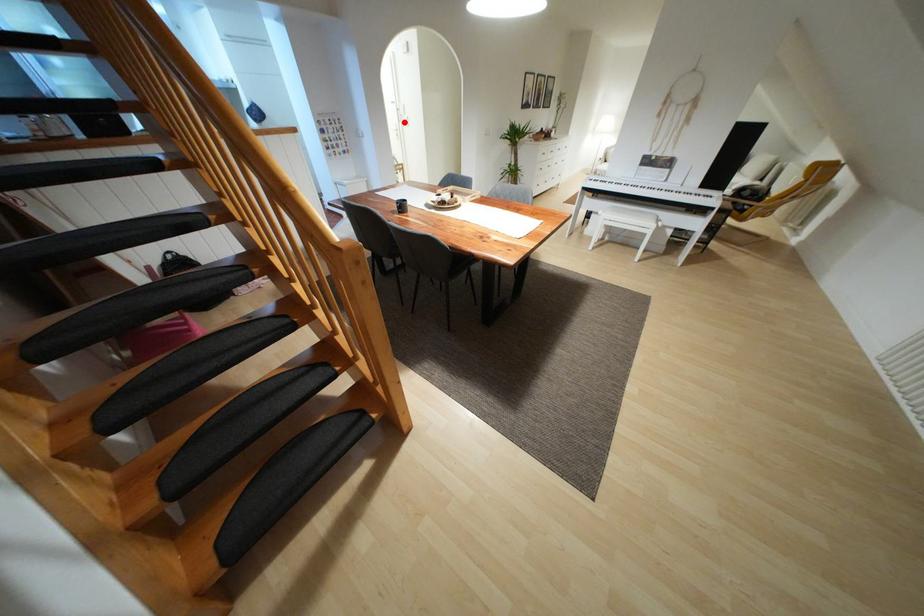
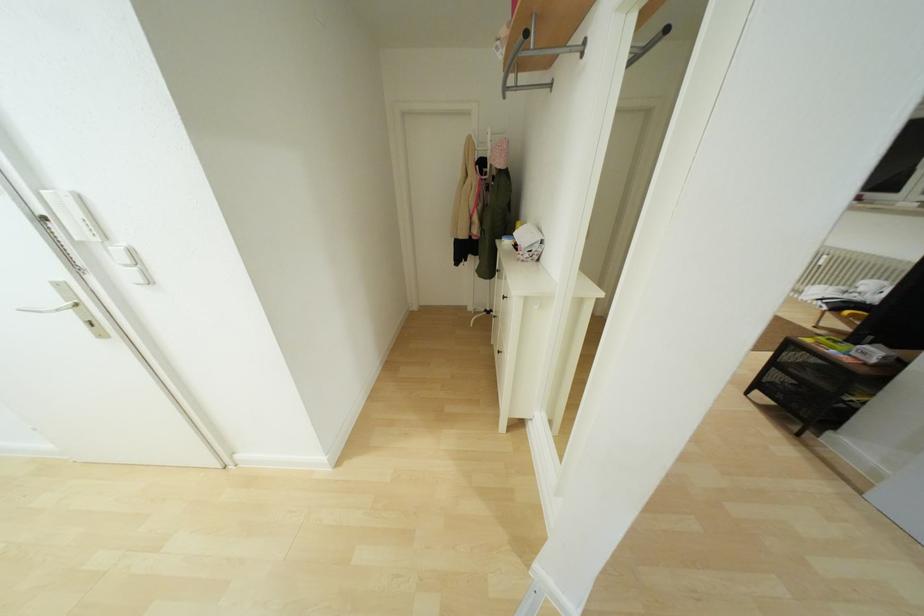
Where in the second image is the point corresponding to the highlighted location from the first image?

(125, 273)